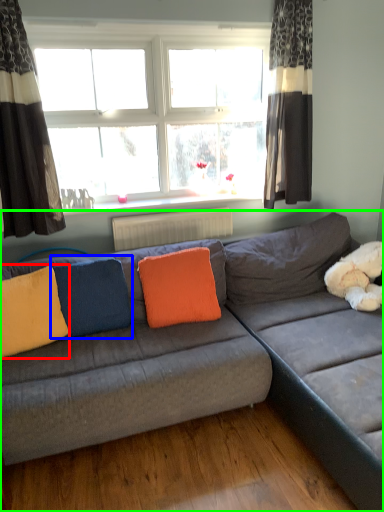
Question: Considering the real-world distances, which object is farthest from pillow (highlighted by a red box)? pillow (highlighted by a blue box) or studio couch (highlighted by a green box)?

Choices:
 (A) pillow
 (B) studio couch

Answer: (B)